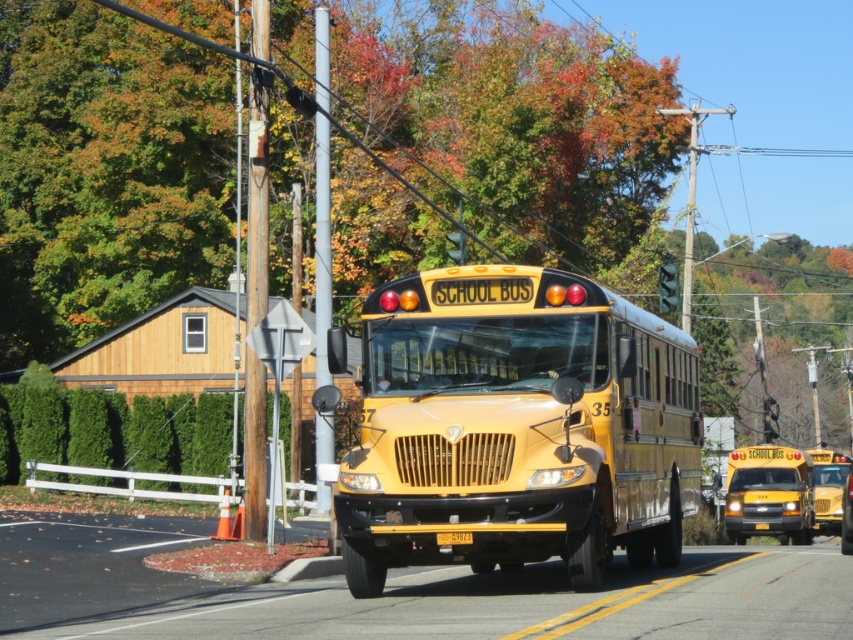
Between yellow matte/solid school bus at center and matte yellow school bus at center, which one has more height?

yellow matte/solid school bus at center

Who is positioned more to the left, yellow matte/solid school bus at center or matte yellow school bus at center?

yellow matte/solid school bus at center is more to the left.

Is point (570, 291) positioned before point (759, 518)?

That is True.

In order to click on yellow matte/solid school bus at center in this screenshot , I will do `click(515, 428)`.

Measure the distance between point [363,560] and camera.

Point [363,560] is 42.00 feet away from camera.

Does yellow matte/solid school bus at center appear under brown wooden pole at left?

Yes, yellow matte/solid school bus at center is below brown wooden pole at left.

You are a GUI agent. You are given a task and a screenshot of the screen. Output one action in this format:
    pyautogui.click(x=<x>, y=<y>)
    Task: Click on the yellow matte/solid school bus at center
    The height and width of the screenshot is (640, 853).
    Given the screenshot: What is the action you would take?
    pyautogui.click(x=515, y=428)

This screenshot has height=640, width=853. Describe the element at coordinates (257, 196) in the screenshot. I see `brown wooden pole at left` at that location.

Who is more forward, (247, 349) or (316, 460)?

Point (247, 349) is in front.

What do you see at coordinates (257, 196) in the screenshot? I see `brown wooden pole at left` at bounding box center [257, 196].

Where is `brown wooden pole at left`? Image resolution: width=853 pixels, height=640 pixels. brown wooden pole at left is located at coordinates (257, 196).